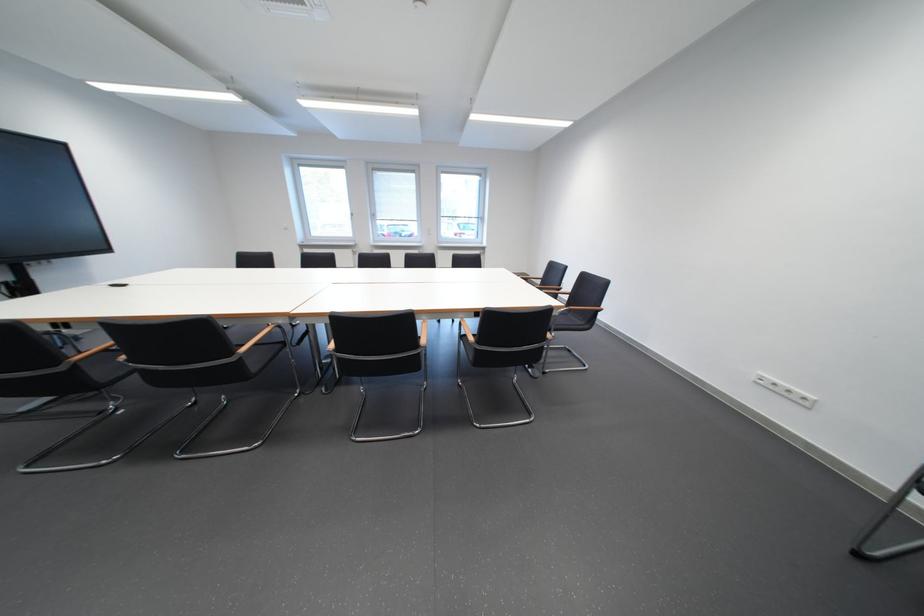
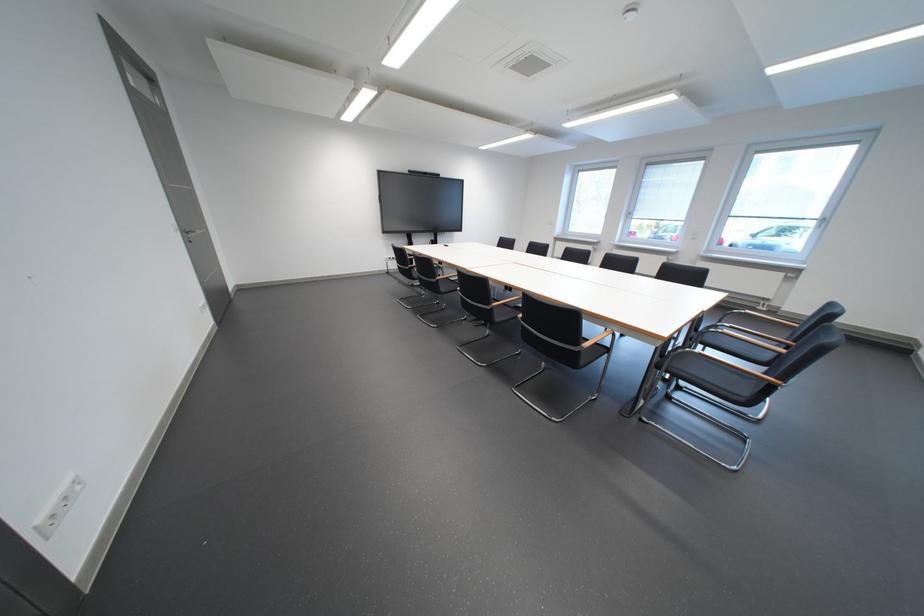
The point at (247, 376) is marked in the first image. Where is the corresponding point in the second image?

(447, 290)